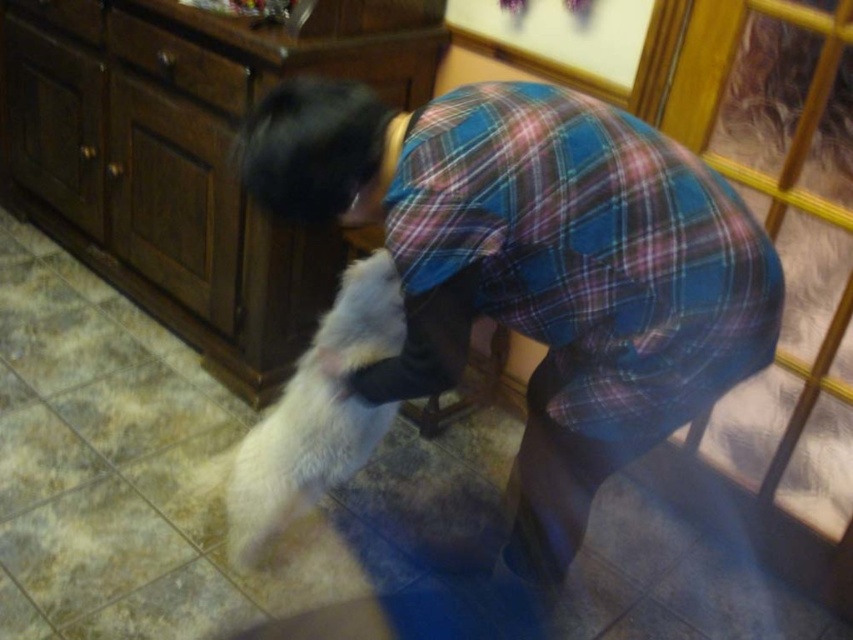
You are standing in the room and want to exit through the transparent glass door at upper right. Which direction should you move relative to the blue plaid shirt at center?

The blue plaid shirt at center is to the left of the transparent glass door at upper right, so you should move to the right relative to the blue plaid shirt at center to reach the transparent glass door at upper right.

You are taking a photo of the scene and want to focus on both the person and the dog. Since the person is at point (306, 120) and the dog is at point (277, 486), which one should you adjust your focus on first to ensure both are in clear view?

Point (306, 120) is closer to the camera than point (277, 486), so you should focus on the person first at point (306, 120) to ensure both are in clear view.